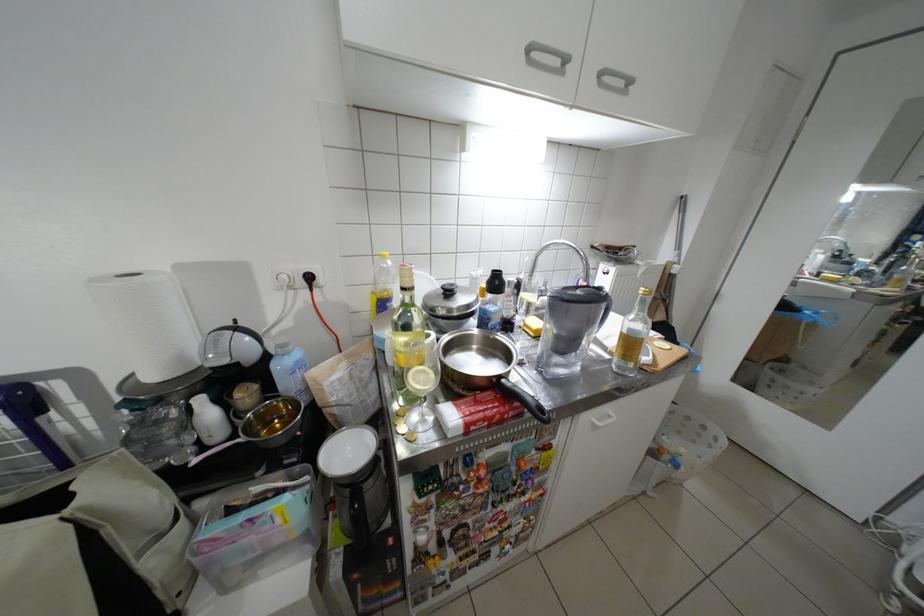
At what (x,y) coordinates should I click in order to perform the action: click on frying pan handle. Please return your answer as a coordinate pair (x, y). Looking at the image, I should click on (523, 399).